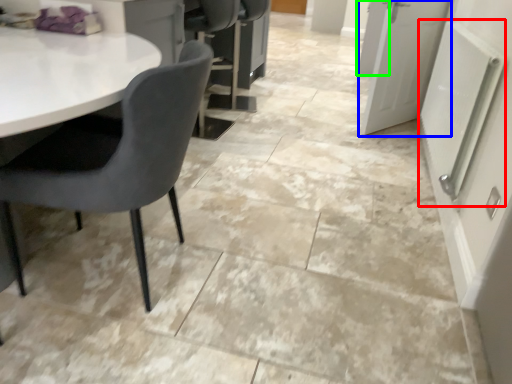
Question: Based on their relative distances, which object is nearer to radiator (highlighted by a red box)? Choose from door (highlighted by a blue box) and door (highlighted by a green box).

Choices:
 (A) door
 (B) door

Answer: (A)